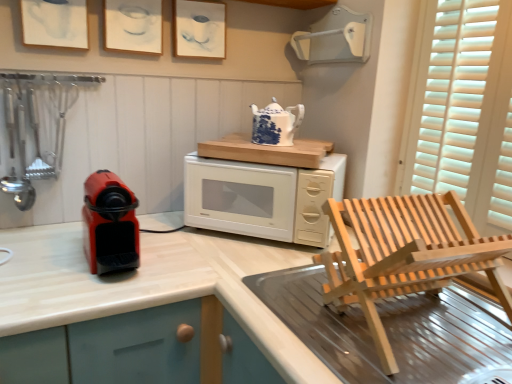
Question: Is the depth of matte paper picture frame at upper left, arranged as the 1th picture frame when viewed from the left, less than that of natural wood chair at lower right?

Choices:
 (A) yes
 (B) no

Answer: (B)

Question: Is matte paper picture frame at upper left, the third picture frame from the right, to the left of natural wood chair at lower right from the viewer's perspective?

Choices:
 (A) no
 (B) yes

Answer: (B)

Question: Considering the relative sizes of matte paper picture frame at upper left, arranged as the 1th picture frame when viewed from the left, and natural wood chair at lower right in the image provided, is matte paper picture frame at upper left, arranged as the 1th picture frame when viewed from the left, taller than natural wood chair at lower right?

Choices:
 (A) yes
 (B) no

Answer: (B)

Question: Is matte paper picture frame at upper left, the third picture frame from the right, beside natural wood chair at lower right?

Choices:
 (A) no
 (B) yes

Answer: (A)

Question: Is matte paper picture frame at upper left, arranged as the 1th picture frame when viewed from the left, further to camera compared to natural wood chair at lower right?

Choices:
 (A) no
 (B) yes

Answer: (B)

Question: Is white glossy microwave oven at center to the left or to the right of blue and white ceramic teapot at upper center in the image?

Choices:
 (A) right
 (B) left

Answer: (B)

Question: Considering the positions of point (217, 168) and point (275, 144), is point (217, 168) closer or farther from the camera than point (275, 144)?

Choices:
 (A) farther
 (B) closer

Answer: (B)

Question: Considering their positions, is white glossy microwave oven at center located in front of or behind blue and white ceramic teapot at upper center?

Choices:
 (A) behind
 (B) front

Answer: (B)

Question: Considering the positions of white glossy microwave oven at center and blue and white ceramic teapot at upper center in the image, is white glossy microwave oven at center taller or shorter than blue and white ceramic teapot at upper center?

Choices:
 (A) short
 (B) tall

Answer: (B)

Question: Is white paper at upper center, which appears as the 3th picture frame when viewed from the left, taller or shorter than blue and white ceramic teapot at upper center?

Choices:
 (A) short
 (B) tall

Answer: (B)

Question: Considering the positions of white paper at upper center, which ranks as the first picture frame in right-to-left order, and blue and white ceramic teapot at upper center in the image, is white paper at upper center, which ranks as the first picture frame in right-to-left order, bigger or smaller than blue and white ceramic teapot at upper center?

Choices:
 (A) big
 (B) small

Answer: (B)

Question: Looking at their shapes, would you say white paper at upper center, which appears as the 3th picture frame when viewed from the left, is wider or thinner than blue and white ceramic teapot at upper center?

Choices:
 (A) thin
 (B) wide

Answer: (A)

Question: From a real-world perspective, is white paper at upper center, which appears as the 3th picture frame when viewed from the left, physically located above or below blue and white ceramic teapot at upper center?

Choices:
 (A) above
 (B) below

Answer: (A)

Question: From the image's perspective, relative to white paper at upper center, which ranks as the first picture frame in right-to-left order, is matte paper picture frame at upper left, arranged as the 1th picture frame when viewed from the left, above or below?

Choices:
 (A) above
 (B) below

Answer: (B)

Question: Considering the positions of matte paper picture frame at upper left, arranged as the 1th picture frame when viewed from the left, and white paper at upper center, which appears as the 3th picture frame when viewed from the left, in the image, is matte paper picture frame at upper left, arranged as the 1th picture frame when viewed from the left, bigger or smaller than white paper at upper center, which appears as the 3th picture frame when viewed from the left,?

Choices:
 (A) big
 (B) small

Answer: (A)